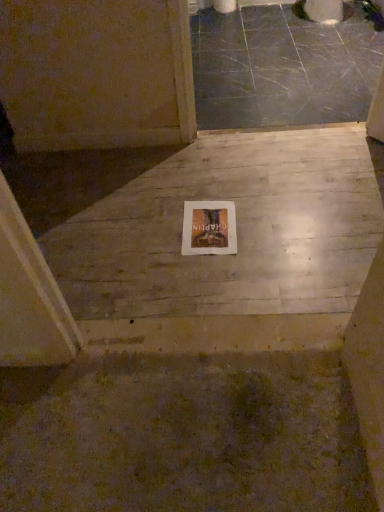
Where is `free space above wooden book at center (from a real-world perspective)`? The image size is (384, 512). free space above wooden book at center (from a real-world perspective) is located at coordinates (210, 225).